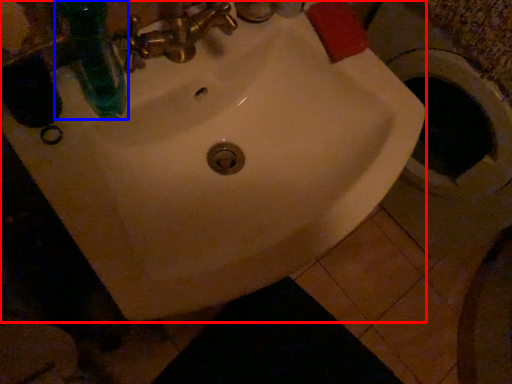
Question: Which of the following is the farthest to the observer, sink (highlighted by a red box) or bottle (highlighted by a blue box)?

Choices:
 (A) sink
 (B) bottle

Answer: (A)